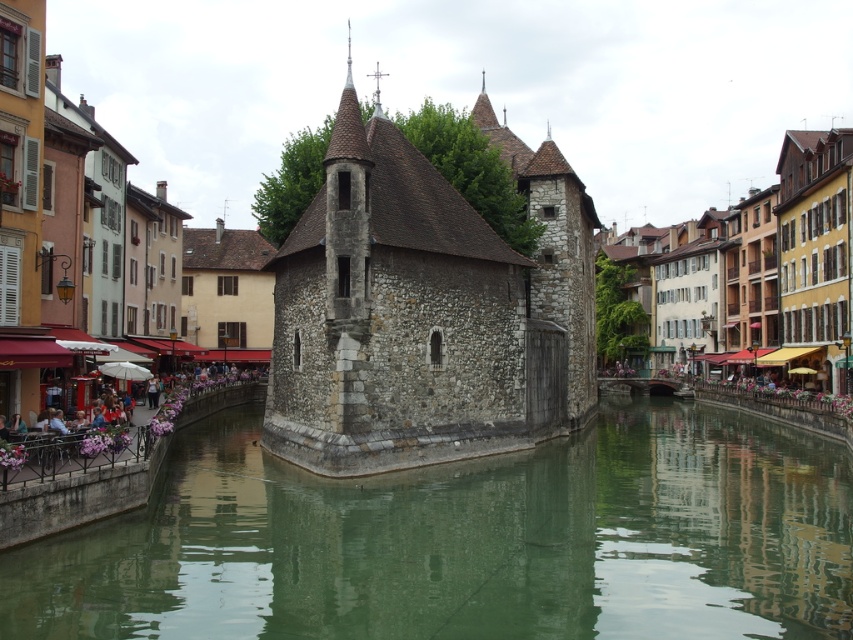
Question: Which point is farther to the camera?

Choices:
 (A) green stone water at center
 (B) stone building at center
 (C) stone/cobblestone castle at center

Answer: (B)

Question: Which point appears farthest from the camera in this image?

Choices:
 (A) (447, 499)
 (B) (351, 84)
 (C) (97, 67)

Answer: (C)

Question: Does green stone water at center appear over stone building at center?

Choices:
 (A) yes
 (B) no

Answer: (B)

Question: Does green stone water at center have a larger size compared to stone building at center?

Choices:
 (A) yes
 (B) no

Answer: (B)

Question: Which point is farther to the camera?

Choices:
 (A) stone/cobblestone castle at center
 (B) green stone water at center

Answer: (A)

Question: Does stone building at center have a smaller size compared to stone/cobblestone castle at center?

Choices:
 (A) no
 (B) yes

Answer: (A)